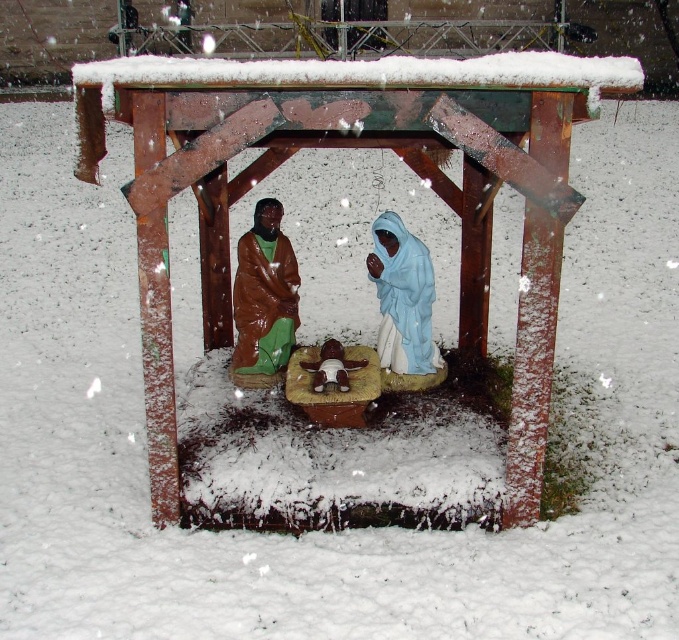
You are an observer looking at the nativity scene. You notice the light blue fabric at center and the brown matte robe at center. Which one appears nearer to you?

The light blue fabric at center appears nearer to you because it is closer to the viewer than the brown matte robe at center.

You are standing in front of a nativity scene display and notice two points marked on the wooden frame. The first point is at coordinates point (433, 291) and the second is at point (238, 342). Which of these points is closer to your viewpoint?

Point (433, 291) is closer to the camera than point (238, 342) according to the description.